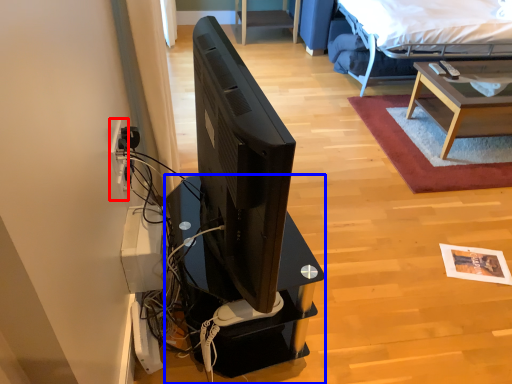
Question: Which object is further to the camera taking this photo, electric outlet (highlighted by a red box) or desk (highlighted by a blue box)?

Choices:
 (A) electric outlet
 (B) desk

Answer: (A)